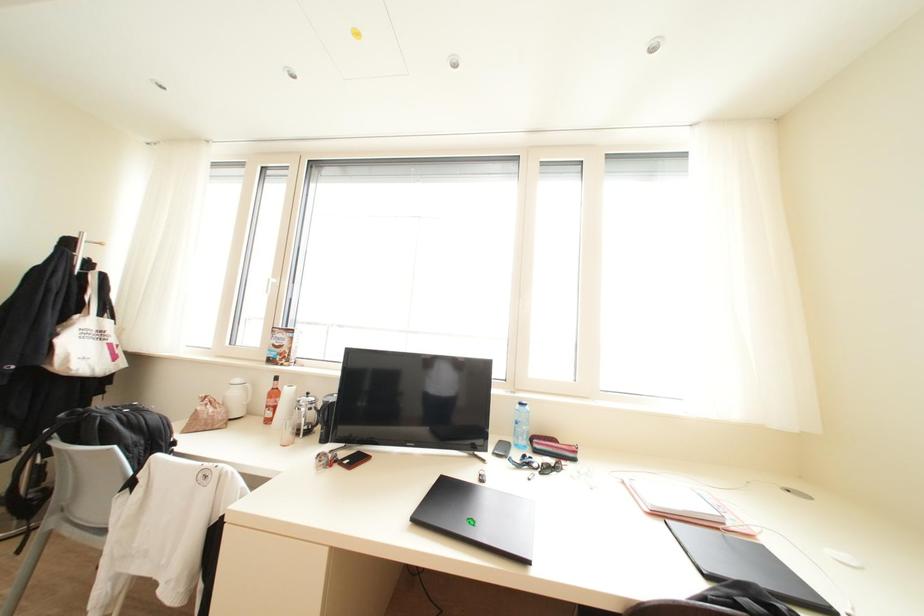
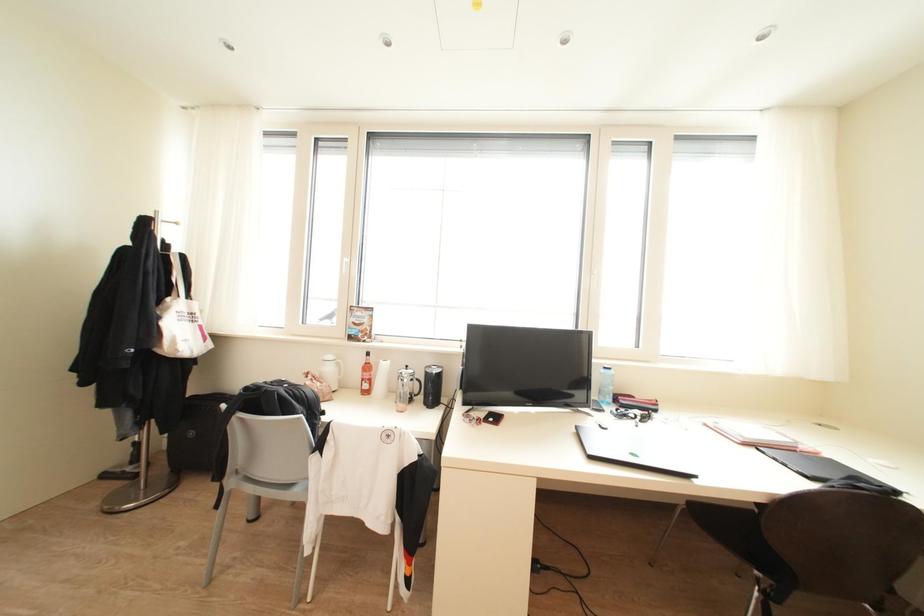
Question: What movement of the cameraman would produce the second image?

Choices:
 (A) Left
 (B) Right
 (C) Forward
 (D) Backward

Answer: (A)